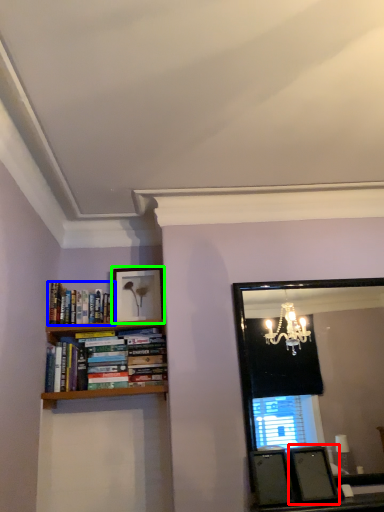
Question: Which is farther away from picture frame (highlighted by a red box)? book (highlighted by a blue box) or picture frame (highlighted by a green box)?

Choices:
 (A) book
 (B) picture frame

Answer: (A)